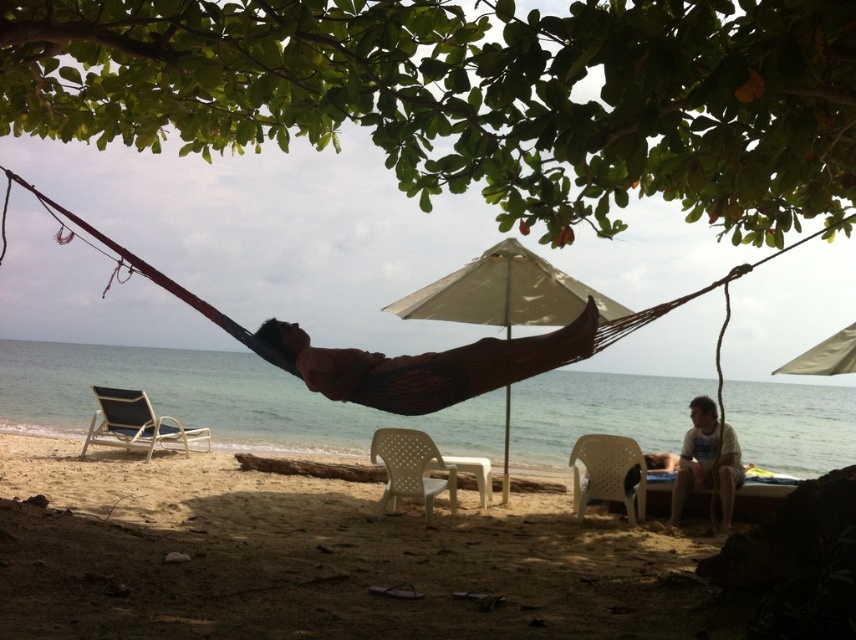
Question: Does green leafy tree at upper center have a smaller size compared to white plastic chair at lower center?

Choices:
 (A) no
 (B) yes

Answer: (B)

Question: Considering the real-world distances, which object is closest to the white plastic beach chair at left?

Choices:
 (A) beige fabric umbrella at center
 (B) white plastic chair at center
 (C) white cotton shirt at lower right

Answer: (B)

Question: Which of these objects is positioned closest to the white plastic chair at lower center?

Choices:
 (A) green leafy tree at upper center
 (B) beige fabric umbrella at center

Answer: (B)

Question: Does white plastic beach chair at left have a larger size compared to white plastic chair at lower center?

Choices:
 (A) no
 (B) yes

Answer: (B)

Question: Which of these objects is positioned closest to the white plastic chair at lower center?

Choices:
 (A) tan fabric umbrella at upper center
 (B) white plastic beach chair at left

Answer: (A)

Question: Does white cotton shirt at lower right lie in front of white plastic chair at lower center?

Choices:
 (A) no
 (B) yes

Answer: (B)